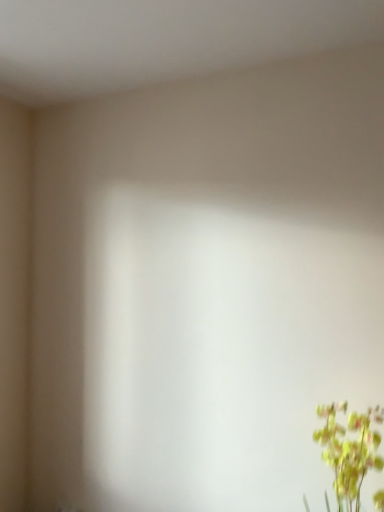
Question: Should I look upward or downward to see yellow matte flower at lower right?

Choices:
 (A) down
 (B) up

Answer: (A)